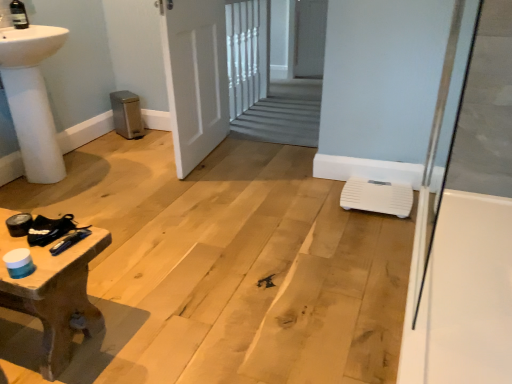
Question: Considering the relative positions of wooden textured table at lower left and white matte door at center in the image provided, is wooden textured table at lower left to the left or to the right of white matte door at center?

Choices:
 (A) right
 (B) left

Answer: (B)

Question: From a real-world perspective, is wooden textured table at lower left positioned above or below white matte door at center?

Choices:
 (A) below
 (B) above

Answer: (A)

Question: Which object is positioned farthest from the metallic blue screwdriver at lower left?

Choices:
 (A) white plastic scale at lower right
 (B) wooden textured table at lower left
 (C) white glossy bath at right
 (D) white matte door at center

Answer: (D)

Question: Based on their relative distances, which object is farther from the white plastic scale at lower right?

Choices:
 (A) wooden textured table at lower left
 (B) white matte door at center
 (C) white glossy bath at right
 (D) metallic blue screwdriver at lower left

Answer: (D)